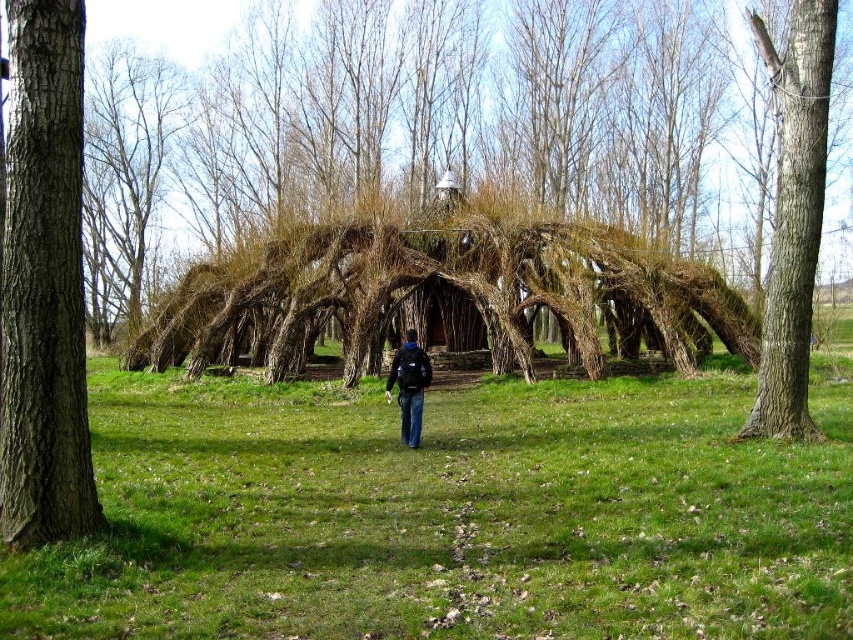
You are standing at the entrance of the rustic structure and looking towards the center of the image. There is a point marked at coordinates (450, 515). What is located at that point?

At point (450, 515) lies green grass at center.

You are standing in a field and see the green grass at center and the smooth brown bark at upper right. Which area takes up more space in the image?

The smooth brown bark at upper right occupies more space than the green grass at center.

You are standing at the entrance of the rustic structure and want to locate the brown rough tree trunk at left. Based on the coordinates provided, in which direction should you look to find it?

The brown rough tree trunk at left is located at coordinates (x=45, y=284), which means it is positioned to the left side of the image. Therefore, you should look to your left to find it.